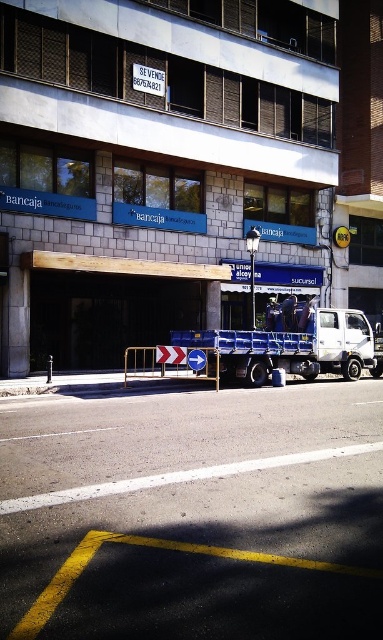
Is point (294, 369) less distant than point (160, 365)?

Yes, it is in front of point (160, 365).

Between point (330, 328) and point (168, 378), which one is positioned behind?

Point (330, 328)

Is point (260, 332) closer to camera compared to point (204, 378)?

That is False.

You are a GUI agent. You are given a task and a screenshot of the screen. Output one action in this format:
    pyautogui.click(x=<x>, y=<y>)
    Task: Click on the white matte truck at center
    The width and height of the screenshot is (383, 640).
    Given the screenshot: What is the action you would take?
    pyautogui.click(x=291, y=348)